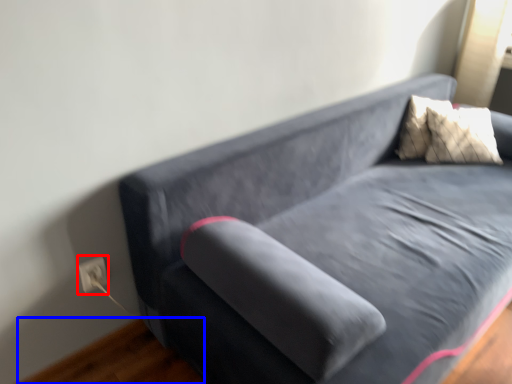
Question: Which object appears farthest to the camera in this image, electric outlet (highlighted by a red box) or hardwood (highlighted by a blue box)?

Choices:
 (A) electric outlet
 (B) hardwood

Answer: (A)